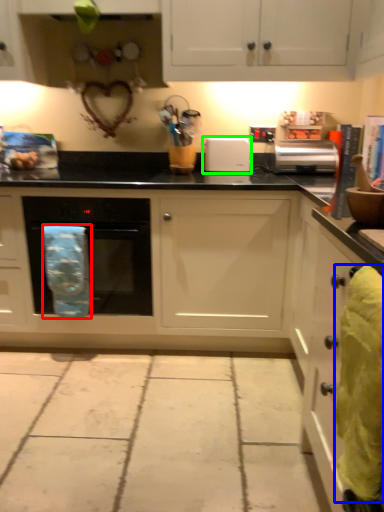
Question: Which is nearer to the material (highlighted by a red box)? material (highlighted by a blue box) or appliance (highlighted by a green box).

Choices:
 (A) material
 (B) appliance

Answer: (B)